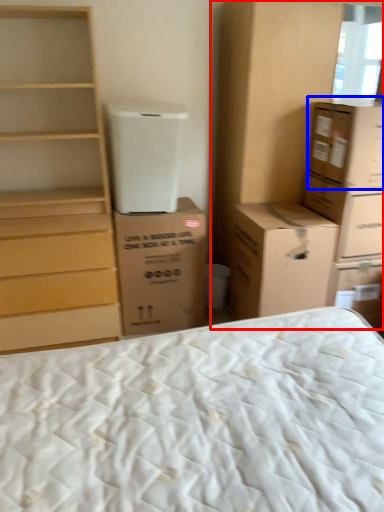
Question: Among these objects, which one is farthest to the camera, cabinetry (highlighted by a red box) or cardboard box (highlighted by a blue box)?

Choices:
 (A) cabinetry
 (B) cardboard box

Answer: (A)